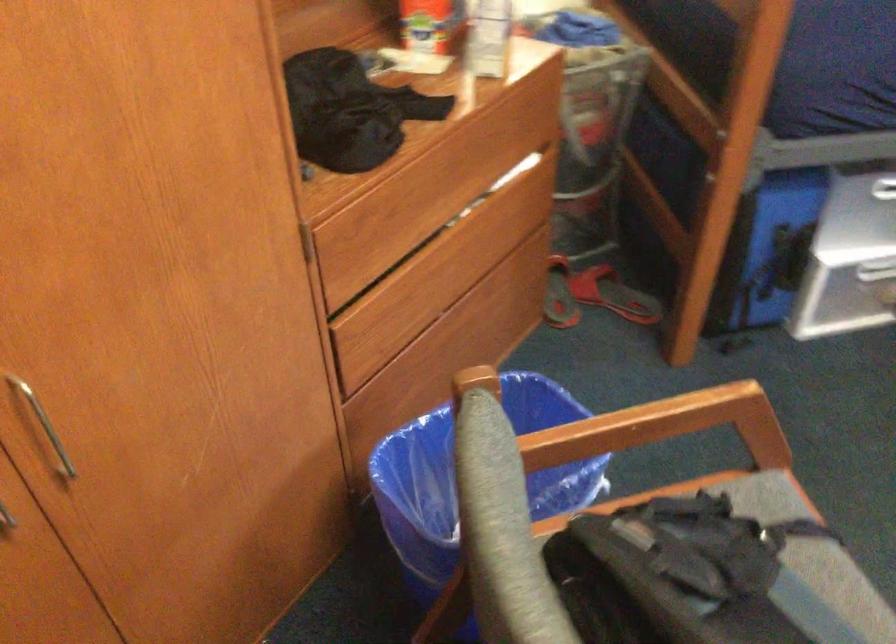
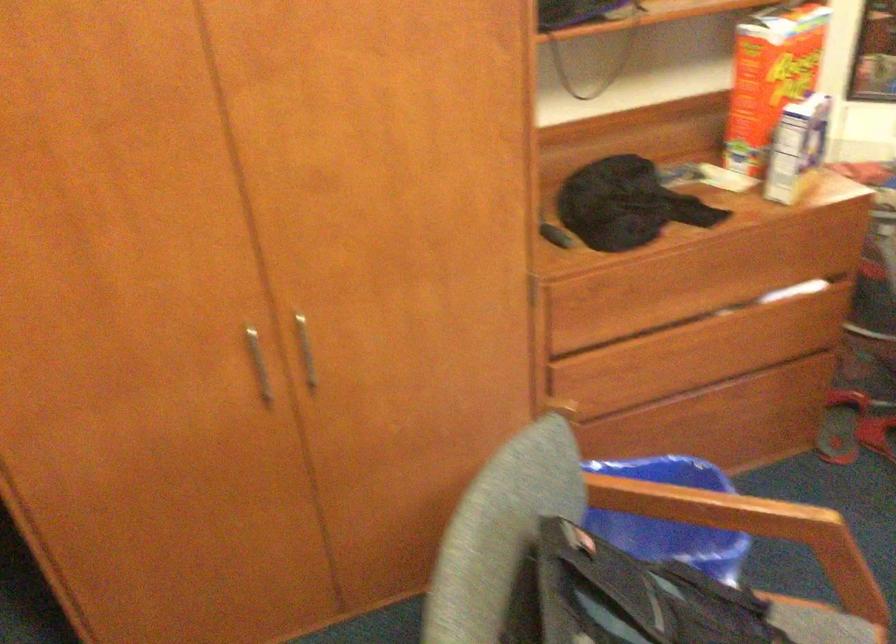
Question: The camera is either moving clockwise (left) or counter-clockwise (right) around the object. The first image is from the beginning of the video and the second image is from the end. Is the camera moving left or right when shooting the video?

Choices:
 (A) Left
 (B) Right

Answer: (B)